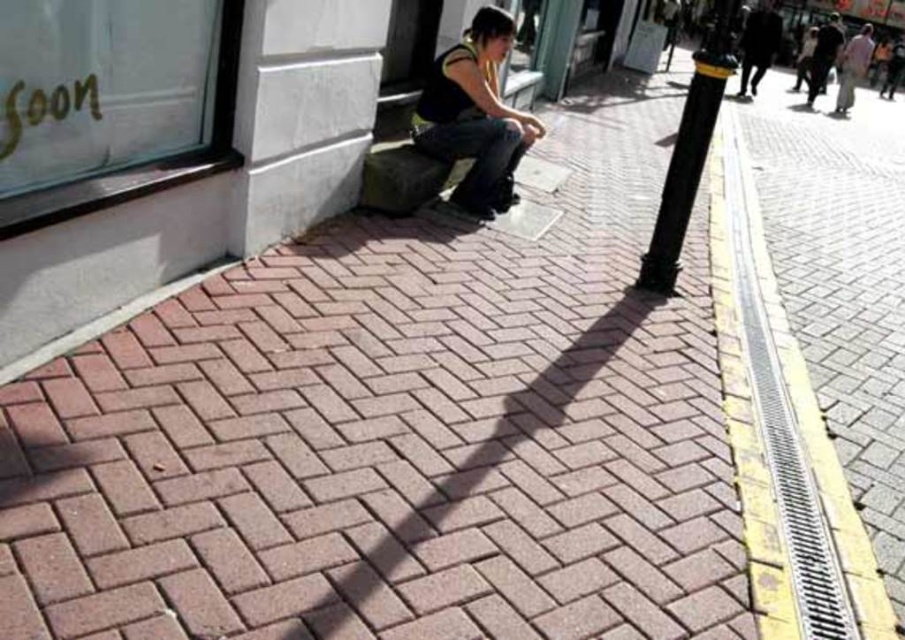
Question: Which object is farther from the camera taking this photo?

Choices:
 (A) yellow textured curb at lower right
 (B) light brown fabric pants at right

Answer: (B)

Question: Which object is closer to the camera taking this photo?

Choices:
 (A) yellow textured curb at lower right
 (B) denim jeans at center

Answer: (A)

Question: Does yellow textured curb at lower right have a lesser width compared to light brown fabric pants at right?

Choices:
 (A) no
 (B) yes

Answer: (A)

Question: Which of these objects is positioned farthest from the dark gray jacket at upper right?

Choices:
 (A) denim jeans at center
 (B) yellow textured curb at lower right
 (C) light brown fabric pants at right
 (D) dark fabric jacket at upper right

Answer: (A)

Question: Is yellow textured curb at lower right bigger than light brown fabric pants at right?

Choices:
 (A) no
 (B) yes

Answer: (B)

Question: Can you confirm if denim jeans at center is positioned to the left of light brown fabric pants at right?

Choices:
 (A) yes
 (B) no

Answer: (A)